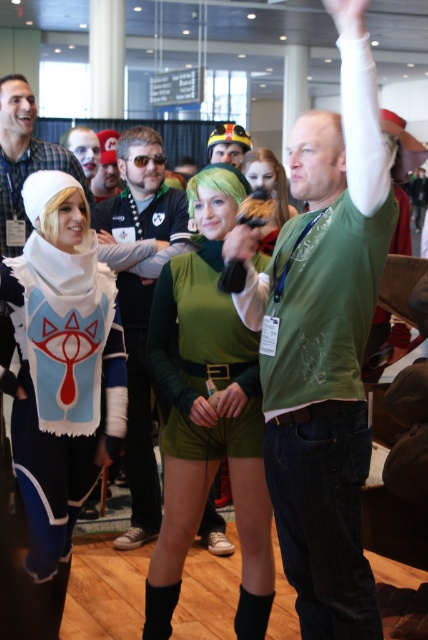
Question: Does green matte dress at center have a greater width compared to green fabric dress at center?

Choices:
 (A) yes
 (B) no

Answer: (A)

Question: Which of the following is the closest to the observer?

Choices:
 (A) green matte shorts at center
 (B) green corduroy shirt at center

Answer: (B)

Question: Does matte white scarf at left have a lesser width compared to green fabric dress at center?

Choices:
 (A) no
 (B) yes

Answer: (A)

Question: Does green matte shorts at center come behind green fabric dress at center?

Choices:
 (A) yes
 (B) no

Answer: (B)

Question: Based on their relative distances, which object is nearer to the matte green helmet at center?

Choices:
 (A) matte white scarf at left
 (B) green matte shorts at center
 (C) green fabric dress at center
 (D) white plush cape at left

Answer: (C)

Question: Considering the real-world distances, which object is closest to the green corduroy shirt at center?

Choices:
 (A) matte green helmet at center
 (B) matte white scarf at left
 (C) matte black mask at center
 (D) green fabric dress at center

Answer: (D)